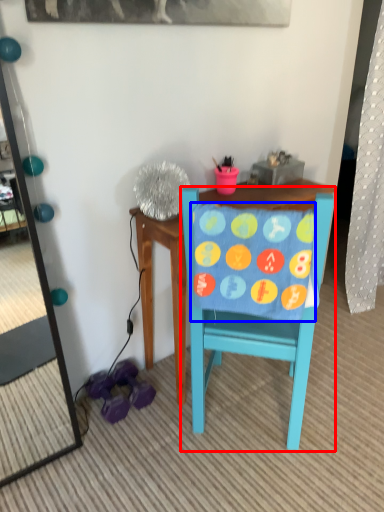
Question: Which point is further to the camera, chair (highlighted by a red box) or blanket (highlighted by a blue box)?

Choices:
 (A) chair
 (B) blanket

Answer: (A)